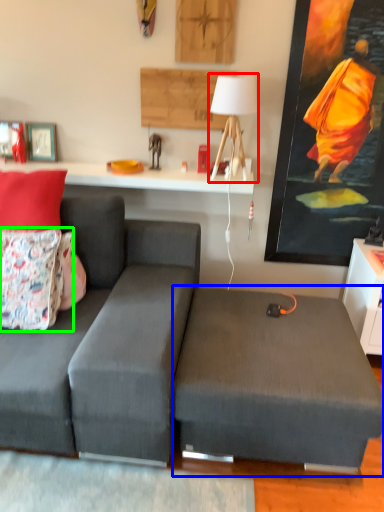
Question: Estimate the real-world distances between objects in this image. Which object is farther from table lamp (highlighted by a red box), swivel chair (highlighted by a blue box) or pillow (highlighted by a green box)?

Choices:
 (A) swivel chair
 (B) pillow

Answer: (B)